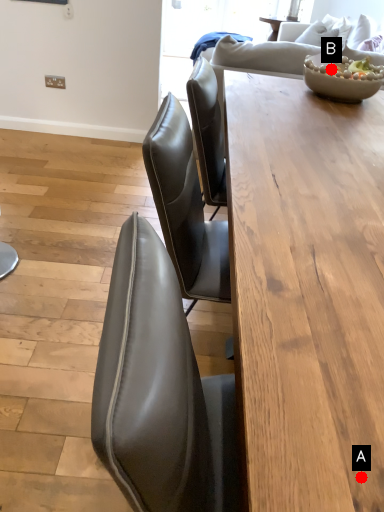
Question: Two points are circled on the image, labeled by A and B beside each circle. Which point is closer to the camera?

Choices:
 (A) A is closer
 (B) B is closer

Answer: (A)